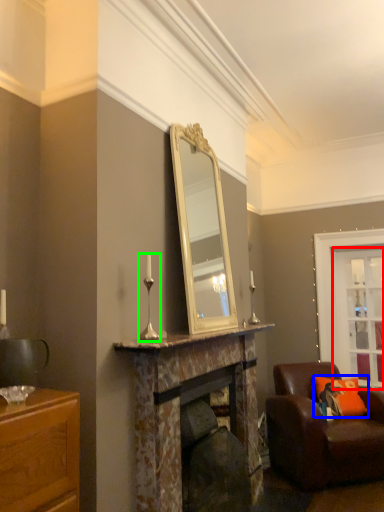
Question: Based on their relative distances, which object is farther from glass door (highlighted by a red box)? Choose from pillow (highlighted by a blue box) and candle holder (highlighted by a green box).

Choices:
 (A) pillow
 (B) candle holder

Answer: (B)